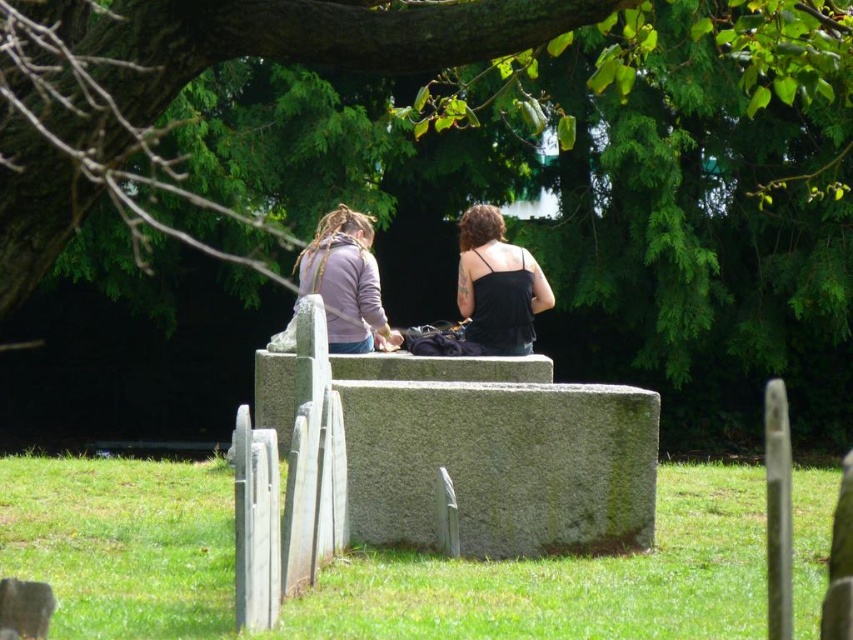
You are a gardener who needs to trim the green leafy tree at upper center. To avoid damaging the green mossy stone at center, where should you focus your trimming efforts?

The green mossy stone at center is below the green leafy tree at upper center, so you should focus trimming the branches above the stone to avoid damaging it.

You are a gardener planning to trim the green leafy tree at upper center and the green mossy stone at center. Which object requires a ladder to reach?

The green leafy tree at upper center requires a ladder because it is larger than the green mossy stone at center, making it harder to reach without assistance.

You are standing in a cemetery and see the green mossy stone at center. If you want to place a flower pot that requires 1 meter of space in front of it, will there be enough space between you and the stone?

The distance between you and the green mossy stone at center is 10.83 meters, so yes, there is enough space to place a flower pot requiring 1 meter in front of it.